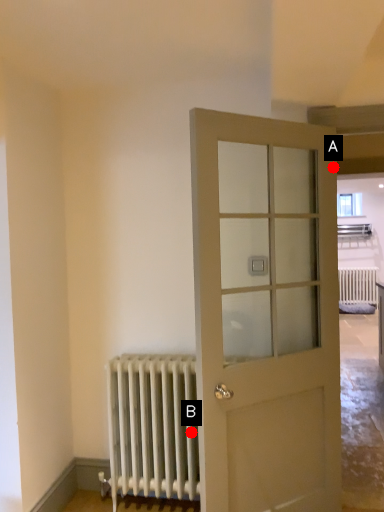
Question: Two points are circled on the image, labeled by A and B beside each circle. Which point appears farthest from the camera in this image?

Choices:
 (A) A is further
 (B) B is further

Answer: (B)